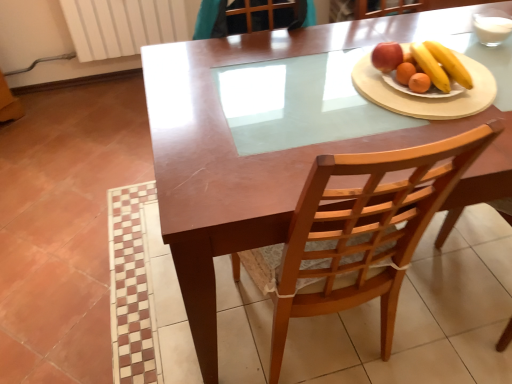
You are a GUI agent. You are given a task and a screenshot of the screen. Output one action in this format:
    pyautogui.click(x=<x>, y=<y>)
    Task: Click on the free space that is to the left of white ceramic plate at upper right
    This screenshot has width=512, height=384.
    Given the screenshot: What is the action you would take?
    pyautogui.click(x=291, y=87)